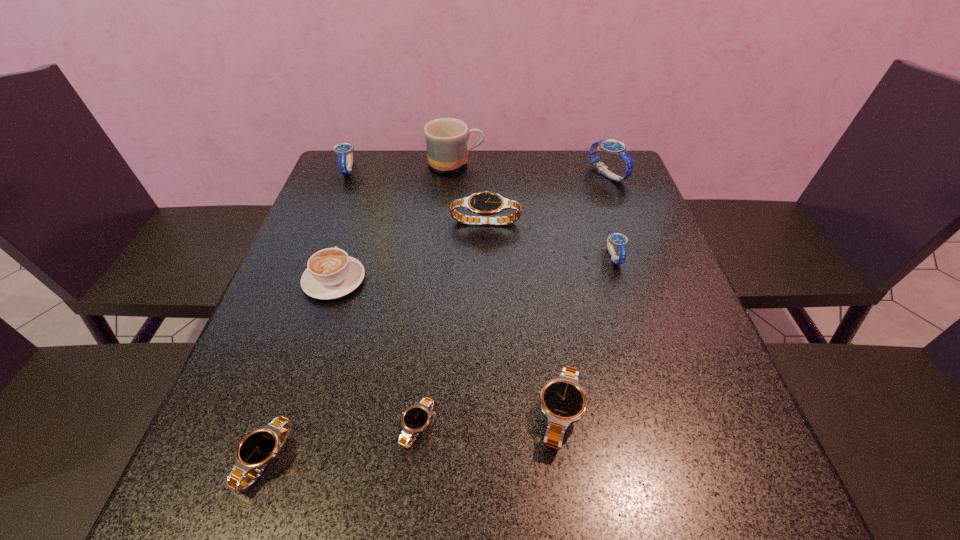
At what (x,y) coordinates should I click in order to perform the action: click on free spot located 0.150m on the side of the cappuccino with the handle. Please return your answer as a coordinate pair (x, y). Looking at the image, I should click on (354, 220).

Find the location of a particular element. The image size is (960, 540). vacant space situated 0.330m on the side of the cappuccino with the handle is located at coordinates (367, 181).

Find the location of a particular element. The width and height of the screenshot is (960, 540). free space located 0.090m on the left of the smallest blue watch is located at coordinates (565, 256).

Locate an element on the screen. This screenshot has height=540, width=960. vacant region located on the right of the second biggest black watch is located at coordinates (623, 415).

At what (x,y) coordinates should I click in order to perform the action: click on vacant region located on the back of the third biggest black watch. Please return your answer as a coordinate pair (x, y). This screenshot has height=540, width=960. Looking at the image, I should click on (333, 262).

What are the coordinates of `free space located on the front of the smallest black watch` in the screenshot? It's located at (412, 485).

Image resolution: width=960 pixels, height=540 pixels. Find the location of `mug at the far edge`. mug at the far edge is located at coordinates (446, 139).

At what (x,y) coordinates should I click in order to perform the action: click on object at the near edge. Please return your answer as a coordinate pair (x, y). Looking at the image, I should click on (256, 450).

Where is `cappuccino at the left edge`? This screenshot has height=540, width=960. cappuccino at the left edge is located at coordinates (331, 273).

The height and width of the screenshot is (540, 960). What are the coordinates of `object at the far left corner` in the screenshot? It's located at (344, 150).